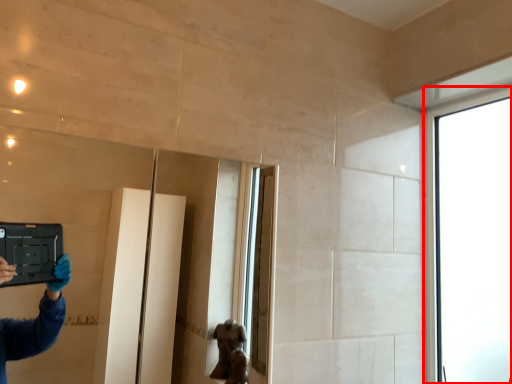
Question: From the image, what is the correct spatial relationship of window (annotated by the red box) in relation to mirror?

Choices:
 (A) left
 (B) right

Answer: (B)